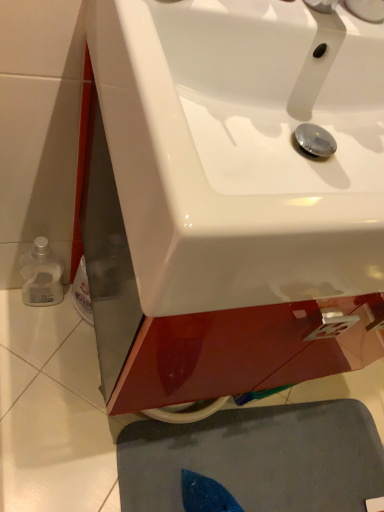
Question: Considering the relative sizes of gray matte bath mat at lower center and white glossy sink at center in the image provided, is gray matte bath mat at lower center thinner than white glossy sink at center?

Choices:
 (A) yes
 (B) no

Answer: (B)

Question: Considering the relative sizes of gray matte bath mat at lower center and white glossy sink at center in the image provided, is gray matte bath mat at lower center shorter than white glossy sink at center?

Choices:
 (A) no
 (B) yes

Answer: (B)

Question: Is gray matte bath mat at lower center bigger than white glossy sink at center?

Choices:
 (A) yes
 (B) no

Answer: (B)

Question: Is gray matte bath mat at lower center looking in the opposite direction of white glossy sink at center?

Choices:
 (A) yes
 (B) no

Answer: (B)

Question: Does gray matte bath mat at lower center appear on the left side of white glossy sink at center?

Choices:
 (A) no
 (B) yes

Answer: (A)

Question: Is gray matte bath mat at lower center taller than white glossy sink at center?

Choices:
 (A) yes
 (B) no

Answer: (B)

Question: Does white glossy sink at center have a smaller size compared to gray matte bath mat at lower center?

Choices:
 (A) yes
 (B) no

Answer: (B)

Question: Can you confirm if white glossy sink at center is shorter than gray matte bath mat at lower center?

Choices:
 (A) no
 (B) yes

Answer: (A)

Question: Does white glossy sink at center lie behind gray matte bath mat at lower center?

Choices:
 (A) no
 (B) yes

Answer: (A)

Question: Considering the relative sizes of white glossy sink at center and gray matte bath mat at lower center in the image provided, is white glossy sink at center thinner than gray matte bath mat at lower center?

Choices:
 (A) yes
 (B) no

Answer: (A)

Question: Is white glossy sink at center with gray matte bath mat at lower center?

Choices:
 (A) yes
 (B) no

Answer: (B)

Question: Is white glossy sink at center not inside gray matte bath mat at lower center?

Choices:
 (A) no
 (B) yes

Answer: (B)

Question: Would you say white glossy sink at center is inside or outside gray matte bath mat at lower center?

Choices:
 (A) outside
 (B) inside

Answer: (A)